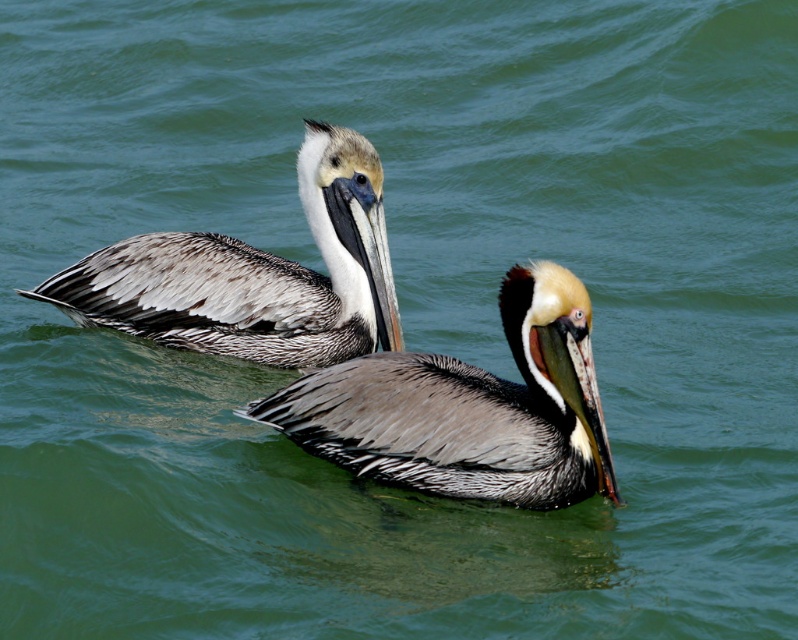
Which is behind, point (583, 394) or point (162, 241)?

Point (162, 241)

Who is shorter, brown feathered pelican at center or brown speckled pelican at upper left?

With less height is brown feathered pelican at center.

Locate an element on the screen. brown feathered pelican at center is located at coordinates (468, 406).